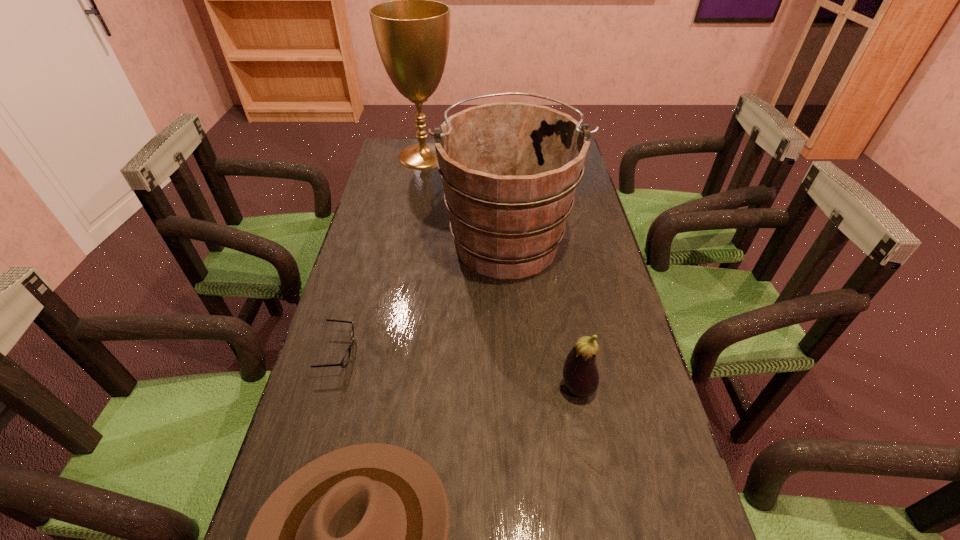
Locate an element on the screen. The width and height of the screenshot is (960, 540). vacant space that's between the fourth shortest object and the spectacles is located at coordinates (423, 296).

Identify the location of unoccupied position between the spectacles and the tallest object. This screenshot has height=540, width=960. (381, 254).

Locate an element on the screen. This screenshot has width=960, height=540. vacant area that lies between the spectacles and the fourth shortest object is located at coordinates (423, 296).

The height and width of the screenshot is (540, 960). Identify the location of vacant space that's between the tallest object and the shortest object. (381, 254).

Identify the location of free spot between the spectacles and the bucket. (423, 296).

Choose which object is the nearest neighbor to the shortest object. Please provide its 2D coordinates. Your answer should be formatted as a tuple, i.e. [(x, y)], where the tuple contains the x and y coordinates of a point satisfying the conditions above.

[(357, 539)]

Find the location of `object that stands as the closest to the nearest object`. object that stands as the closest to the nearest object is located at coordinates (344, 362).

Locate an element on the screen. The height and width of the screenshot is (540, 960). free region that satisfies the following two spatial constraints: 1. on the front-facing side of the spectacles; 2. on the left side of the third shortest object is located at coordinates (328, 388).

Where is `free spot that satisfies the following two spatial constraints: 1. on the back side of the third shortest object; 2. on the front-facing side of the spectacles`? free spot that satisfies the following two spatial constraints: 1. on the back side of the third shortest object; 2. on the front-facing side of the spectacles is located at coordinates (571, 353).